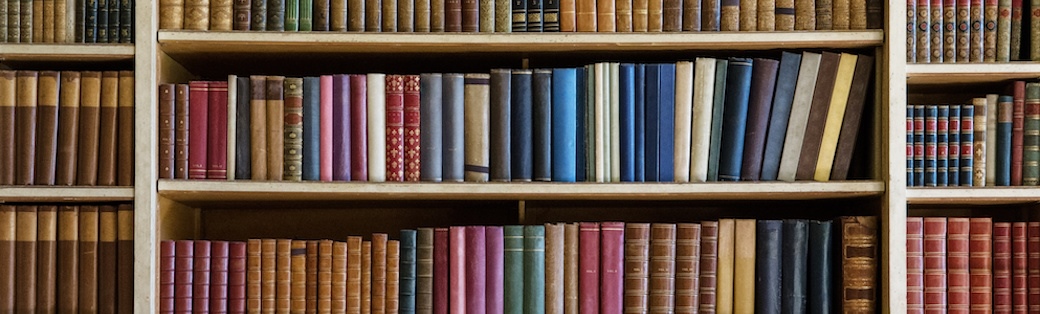
Where is `book shelves`? book shelves is located at coordinates coord(74,47), coord(69,191), coord(185,188), coord(198,37), coord(928,66), coord(944,191).